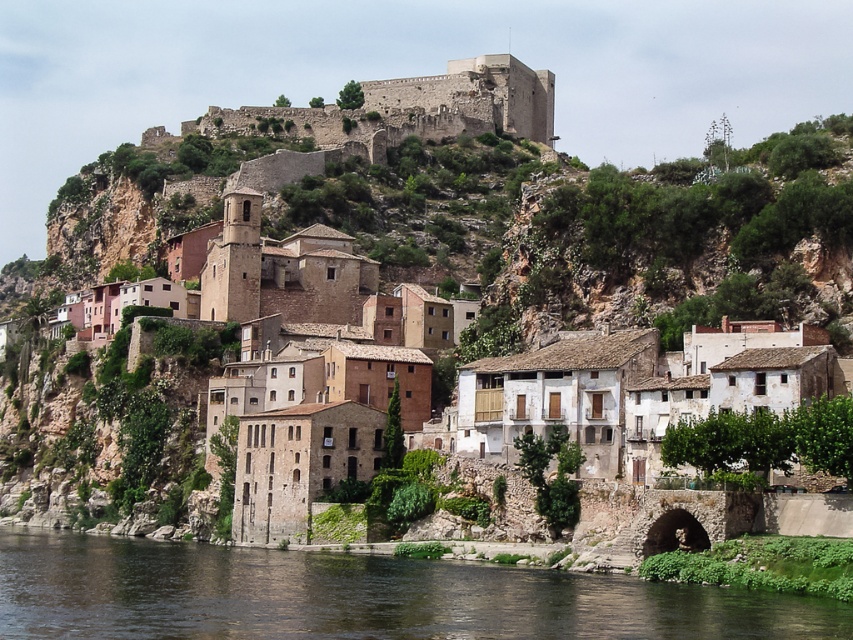
Question: Which is nearer to the dark brown water at lower center?

Choices:
 (A) beige stone houses at center
 (B) rustic stone castle at upper center

Answer: (A)

Question: Estimate the real-world distances between objects in this image. Which object is farther from the beige stone houses at center?

Choices:
 (A) rustic stone castle at upper center
 (B) dark brown water at lower center

Answer: (A)

Question: Is dark brown water at lower center positioned before rustic stone castle at upper center?

Choices:
 (A) no
 (B) yes

Answer: (B)

Question: Does dark brown water at lower center have a lesser width compared to beige stone houses at center?

Choices:
 (A) no
 (B) yes

Answer: (B)

Question: Among these points, which one is nearest to the camera?

Choices:
 (A) (288, 593)
 (B) (614, 444)
 (C) (537, 120)

Answer: (A)

Question: Is dark brown water at lower center thinner than beige stone houses at center?

Choices:
 (A) yes
 (B) no

Answer: (A)